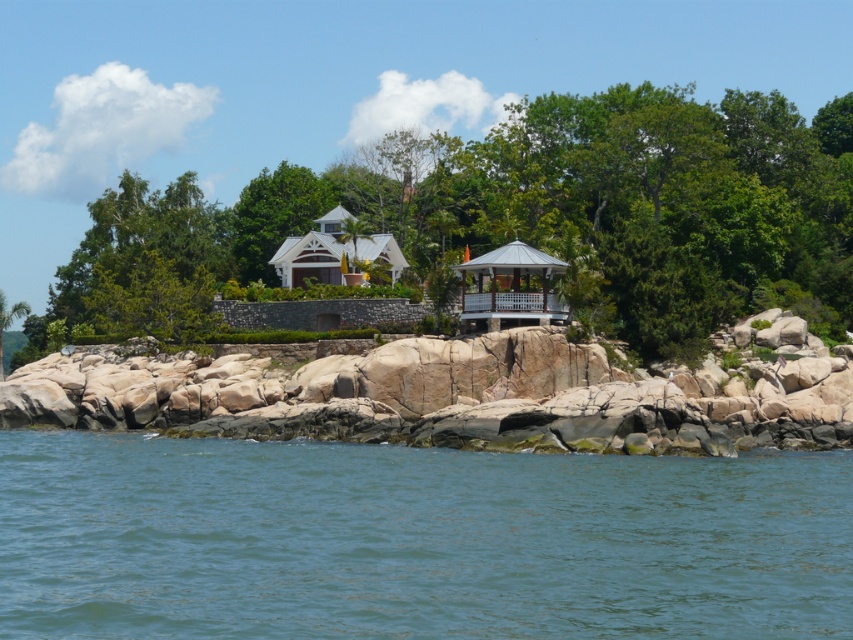
Question: Which is nearer to the rustic stone rocks at center?

Choices:
 (A) metallic gazebo at center
 (B) blue water at lower center

Answer: (B)

Question: Is rustic stone rocks at center smaller than metallic gazebo at center?

Choices:
 (A) no
 (B) yes

Answer: (A)

Question: Is rustic stone rocks at center bigger than metallic gazebo at center?

Choices:
 (A) no
 (B) yes

Answer: (B)

Question: Does blue water at lower center have a lesser width compared to metallic gazebo at center?

Choices:
 (A) no
 (B) yes

Answer: (A)

Question: Which point is farther to the camera?

Choices:
 (A) (302, 404)
 (B) (685, 499)

Answer: (A)

Question: Estimate the real-world distances between objects in this image. Which object is farther from the metallic gazebo at center?

Choices:
 (A) blue water at lower center
 (B) rustic stone rocks at center

Answer: (A)